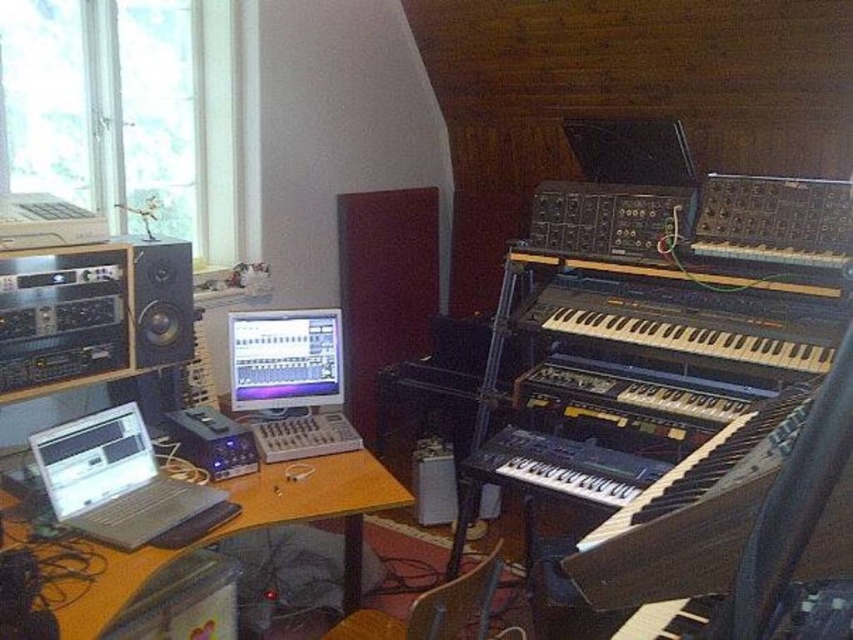
You are setting up a new speaker in your home studio and need to place it precisely at the coordinates given in the scene description. Where should you place the speaker relative to the wooden desk at center?

The wooden desk at center is located at coordinates point (318, 500), so you should place the speaker at that position relative to the wooden desk at center.

You are setting up a home studio and need to place the matte black monitor at center and the matte black speaker at left on your desk. According to the image, which object should be positioned to the right of the other?

A: The matte black monitor at center should be positioned to the right of the matte black speaker at left as per the image description.

You are setting up a new speaker in your home studio. You want to place it to the left of the wooden desk at center. Is the current position of the matte black speaker at left already in the correct spot?

The wooden desk at center is to the right of the matte black speaker at left, so the matte black speaker at left is already positioned to the left of the wooden desk at center. Therefore, it is in the correct spot.